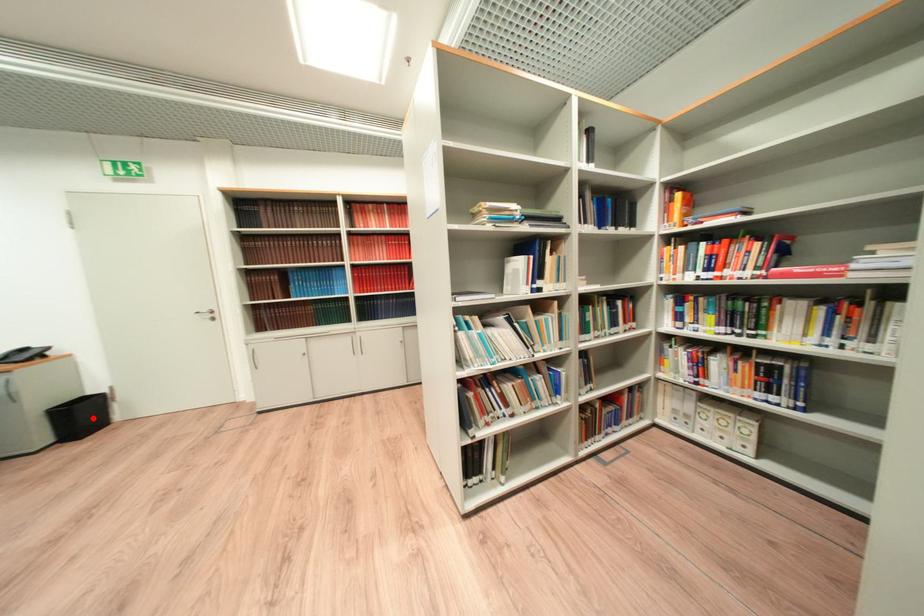
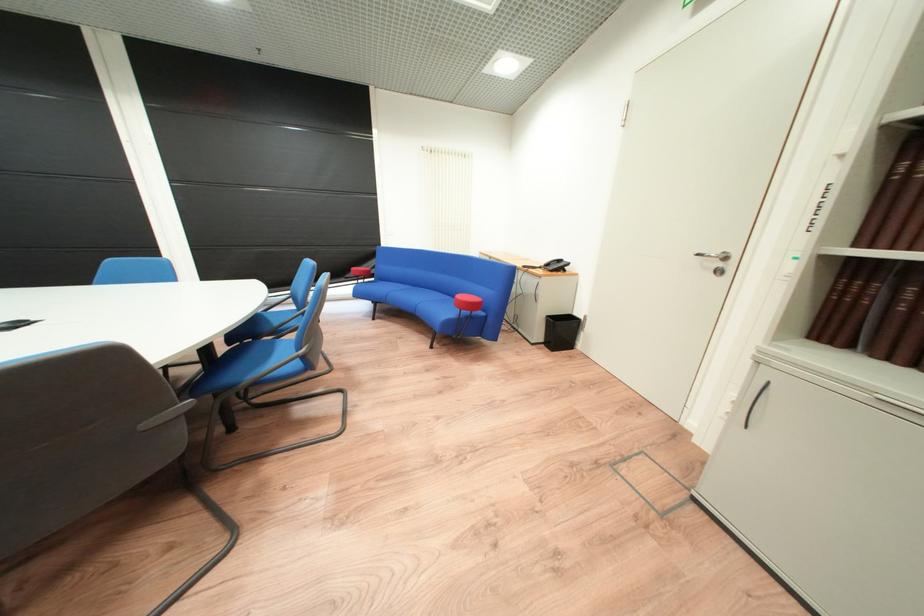
Find the pixel in the second image that matches the highlighted location in the first image.

(573, 333)